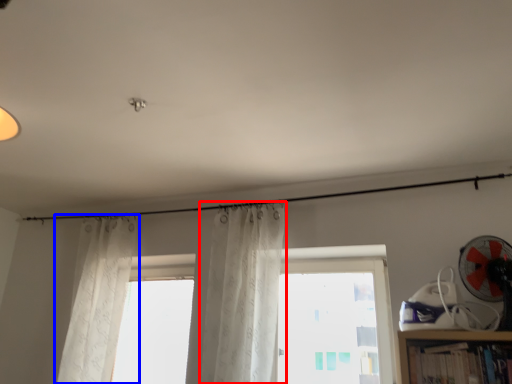
Question: Which object is closer to the camera taking this photo, curtain (highlighted by a red box) or curtain (highlighted by a blue box)?

Choices:
 (A) curtain
 (B) curtain

Answer: (A)